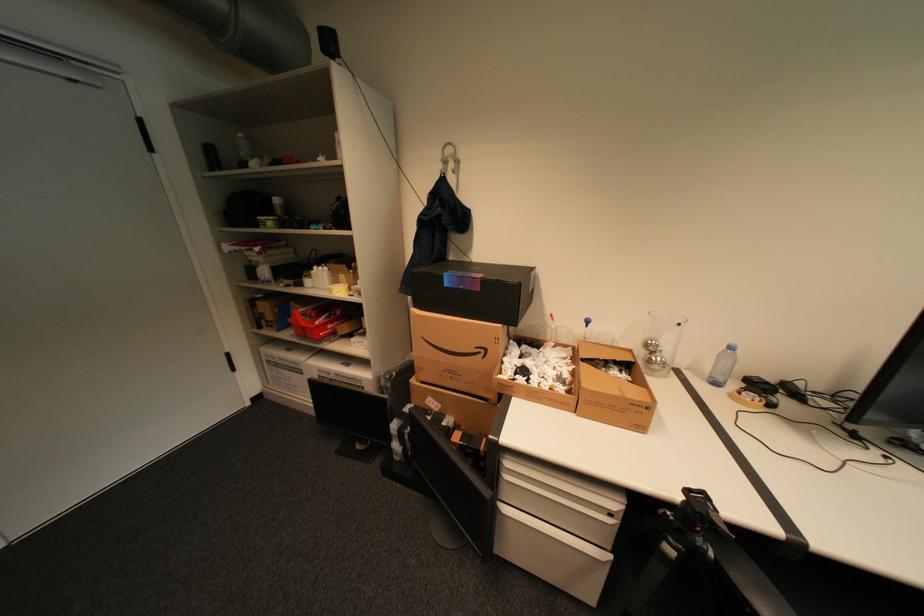
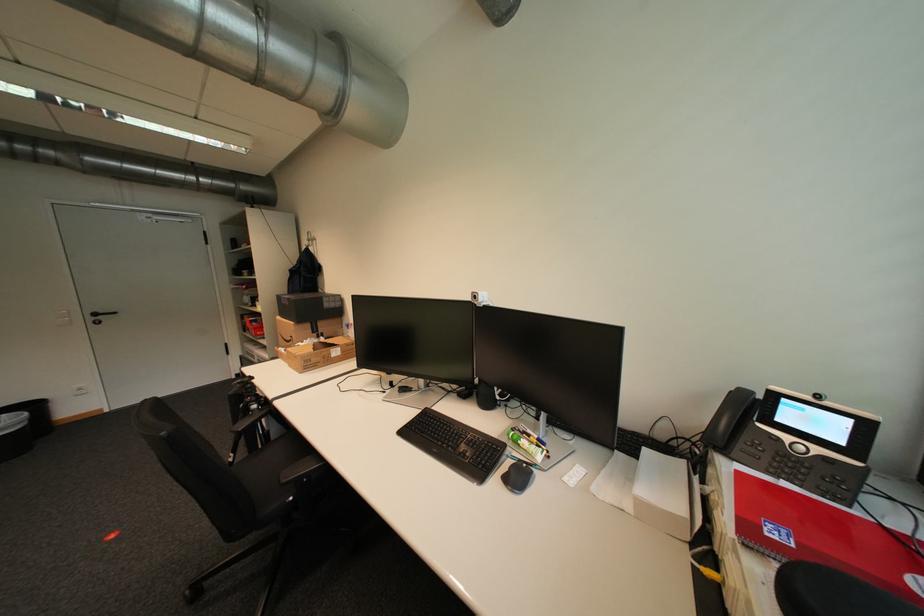
Question: Which direction would the cameraman need to move to produce the second image? Reply with the corresponding letter.

Choices:
 (A) Left
 (B) Right
 (C) Forward
 (D) Backward

Answer: (B)